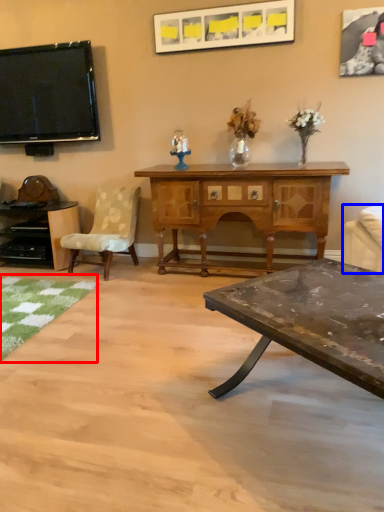
Question: Among these objects, which one is nearest to the camera, mat (highlighted by a red box) or studio couch (highlighted by a blue box)?

Choices:
 (A) mat
 (B) studio couch

Answer: (B)